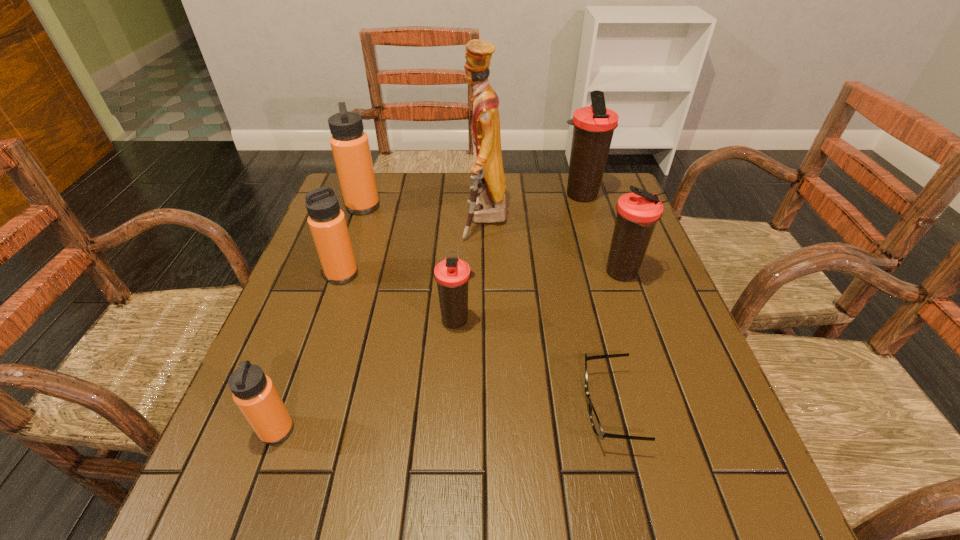
Locate which orange thermos bottle ranks second in proximity to the biggest orange thermos bottle. Please provide its 2D coordinates. Your answer should be formatted as a tuple, i.e. [(x, y)], where the tuple contains the x and y coordinates of a point satisfying the conditions above.

[(254, 393)]